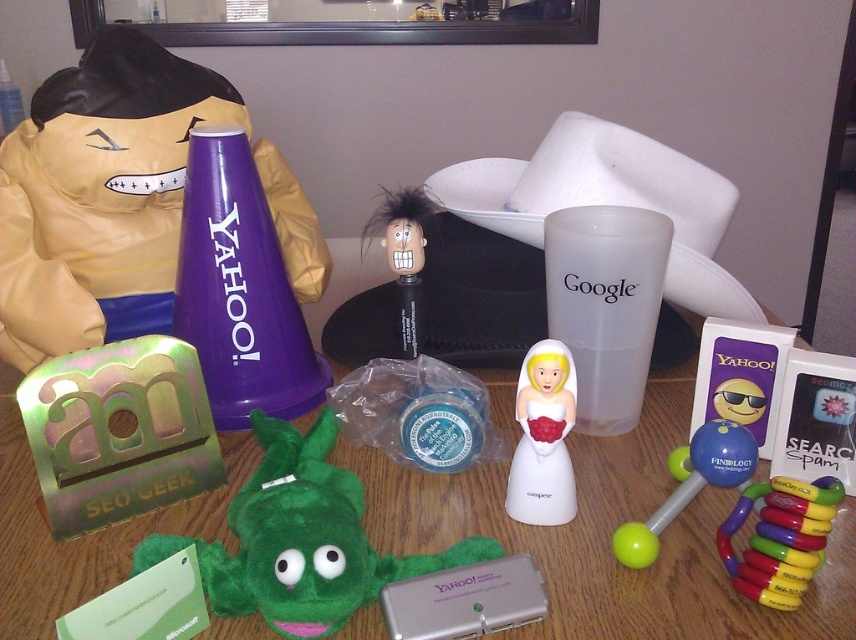
Does green plush toy at center have a smaller size compared to multicolored plastic baby rattle at lower right?

Incorrect, green plush toy at center is not smaller in size than multicolored plastic baby rattle at lower right.

Is point (364, 600) positioned after point (829, 480)?

That is False.

Find the location of a particular element. This screenshot has height=640, width=856. green plush toy at center is located at coordinates (300, 540).

Is wooden table at center taller than green plush toy at center?

Indeed, wooden table at center has a greater height compared to green plush toy at center.

Can you confirm if wooden table at center is bigger than green plush toy at center?

Yes.

In order to click on wooden table at center in this screenshot , I will do `click(608, 538)`.

The height and width of the screenshot is (640, 856). I want to click on wooden table at center, so click(x=608, y=538).

Does multicolored plastic baby rattle at lower right appear on the right side of rubber/plastic dumbbell at center-right?

Indeed, multicolored plastic baby rattle at lower right is positioned on the right side of rubber/plastic dumbbell at center-right.

What do you see at coordinates (780, 538) in the screenshot? I see `multicolored plastic baby rattle at lower right` at bounding box center [780, 538].

Where is `multicolored plastic baby rattle at lower right`? The width and height of the screenshot is (856, 640). multicolored plastic baby rattle at lower right is located at coordinates (780, 538).